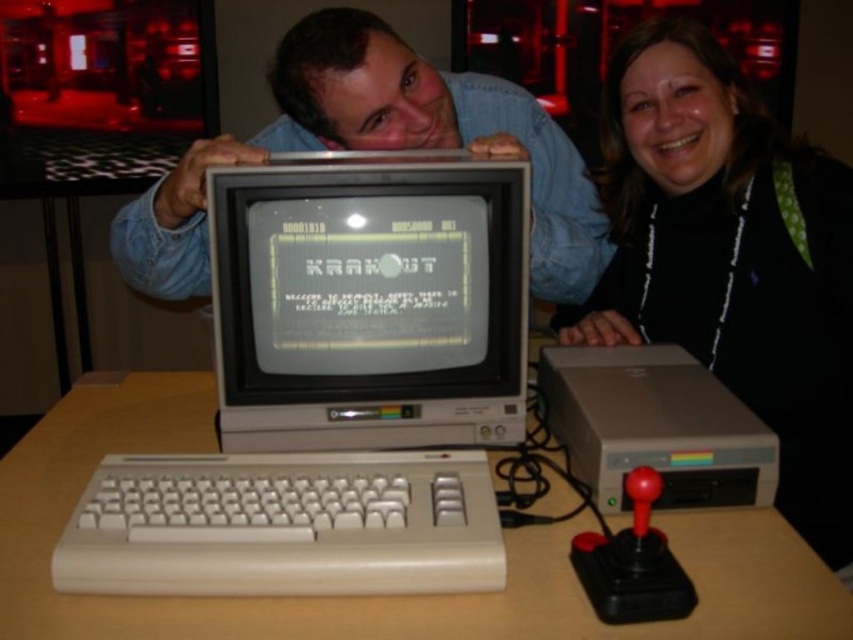
You are setting up a new monitor on the wooden table at center. The monitor requires a stand that must be placed on top of the white plastic keyboard at lower center. Can the stand be placed on the keyboard without it being too low?

The wooden table at center has a greater height compared to white plastic keyboard at lower center, so placing the stand on the keyboard would position it lower than the table. If the monitor stand can adjust to a lower height, it might work, but the keyboard is already lower than the table surface.

You are setting up a home office and want to place the matte gray monitor at center and the matte gray desktop computer at lower right on your desk. The desk has a maximum width of 12 inches between these two items. Will they fit within the desk space?

The distance between the matte gray monitor at center and the matte gray desktop computer at lower right is 11.51 inches, which is under the 12 inch maximum width, so they will fit within the desk space.